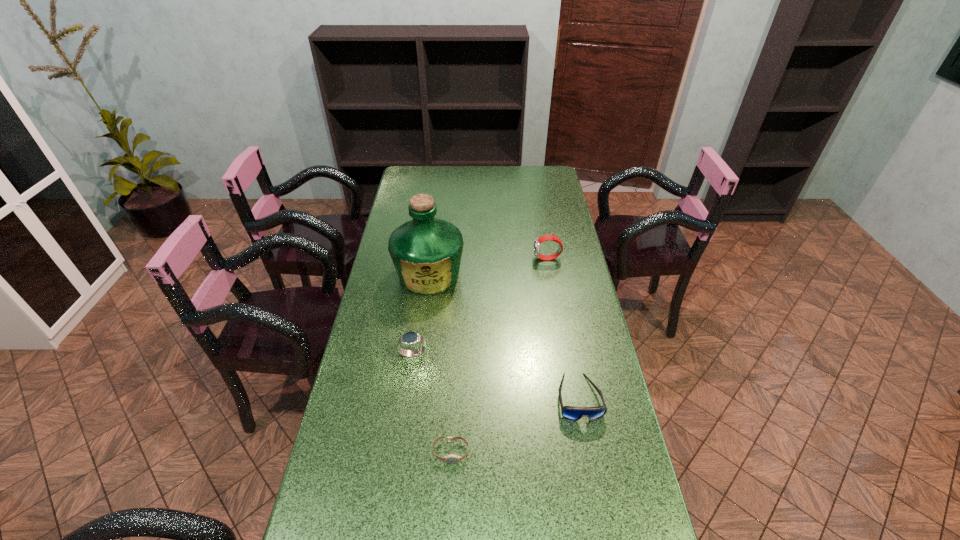
Locate an element on the screen. Image resolution: width=960 pixels, height=540 pixels. free region at the far edge of the desktop is located at coordinates (468, 178).

The height and width of the screenshot is (540, 960). In the image, there is a desktop. Identify the location of free space at the left edge. (403, 302).

Find the location of a particular element. The width and height of the screenshot is (960, 540). blank area at the right edge is located at coordinates (582, 421).

What are the coordinates of `blank space at the far left corner of the desktop` in the screenshot? It's located at (437, 167).

The height and width of the screenshot is (540, 960). What are the coordinates of `vacant space at the far right corner of the desktop` in the screenshot? It's located at (532, 181).

I want to click on vacant region between the fourth tallest object and the liquor, so click(x=504, y=336).

The width and height of the screenshot is (960, 540). Find the location of `free space between the liquor and the nearest object`. free space between the liquor and the nearest object is located at coordinates [x=440, y=363].

This screenshot has height=540, width=960. Find the location of `vacant region between the sunglasses and the third nearest object`. vacant region between the sunglasses and the third nearest object is located at coordinates (495, 376).

Locate an element on the screen. The width and height of the screenshot is (960, 540). unoccupied area between the tallest watch and the leftmost watch is located at coordinates (480, 307).

Where is `free space between the fourth farthest object and the shortest watch`? Image resolution: width=960 pixels, height=540 pixels. free space between the fourth farthest object and the shortest watch is located at coordinates (515, 425).